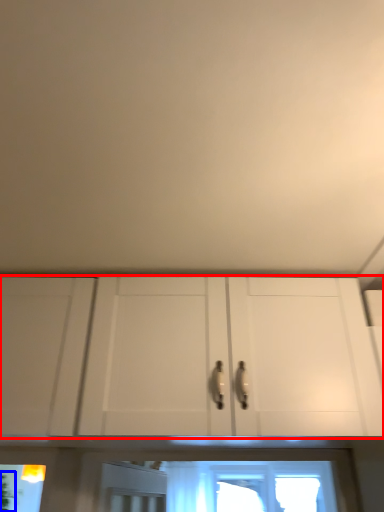
Question: Which object is further to the camera taking this photo, cabinetry (highlighted by a red box) or plant (highlighted by a blue box)?

Choices:
 (A) cabinetry
 (B) plant

Answer: (B)